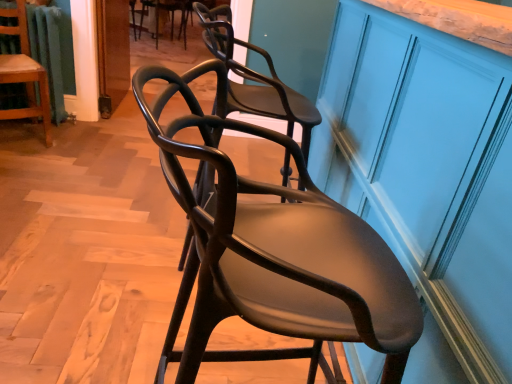
Image resolution: width=512 pixels, height=384 pixels. I want to click on vacant space underneath wooden chair at left, which is counted as the second chair, starting from the bottom (from a real-world perspective), so click(x=27, y=126).